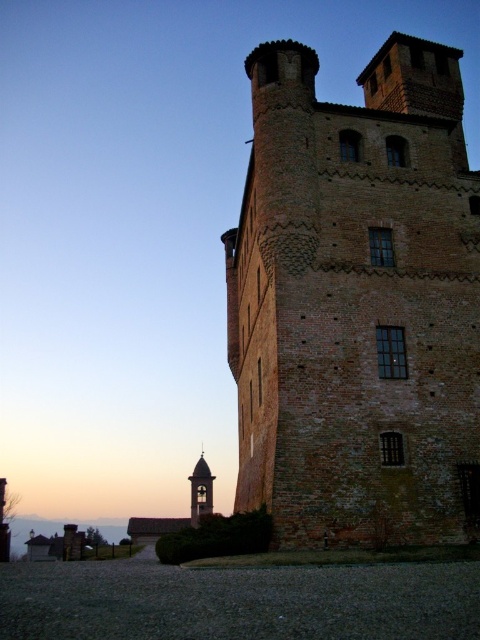
Between point (354, 291) and point (199, 464), which one is positioned in front?

Positioned in front is point (354, 291).

Does brown brick tower at center right appear under smooth stone bell tower at lower center?

No.

Does point (406, 360) come in front of point (192, 474)?

That is True.

Find the location of a particular element. Image resolution: width=480 pixels, height=640 pixels. brown brick tower at center right is located at coordinates (358, 301).